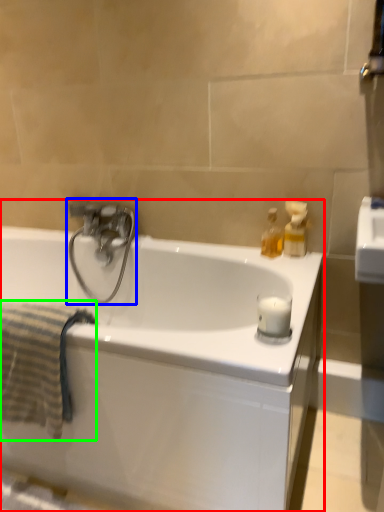
Question: Which is farther away from bathtub (highlighted by a red box)? tap (highlighted by a blue box) or bath towel (highlighted by a green box)?

Choices:
 (A) tap
 (B) bath towel

Answer: (A)